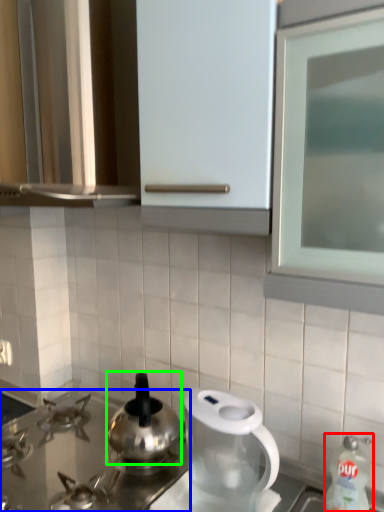
Question: Based on their relative distances, which object is farther from cleaning product (highlighted by a red box)? Choose from gas stove (highlighted by a blue box) and kitchen appliance (highlighted by a green box).

Choices:
 (A) gas stove
 (B) kitchen appliance

Answer: (A)